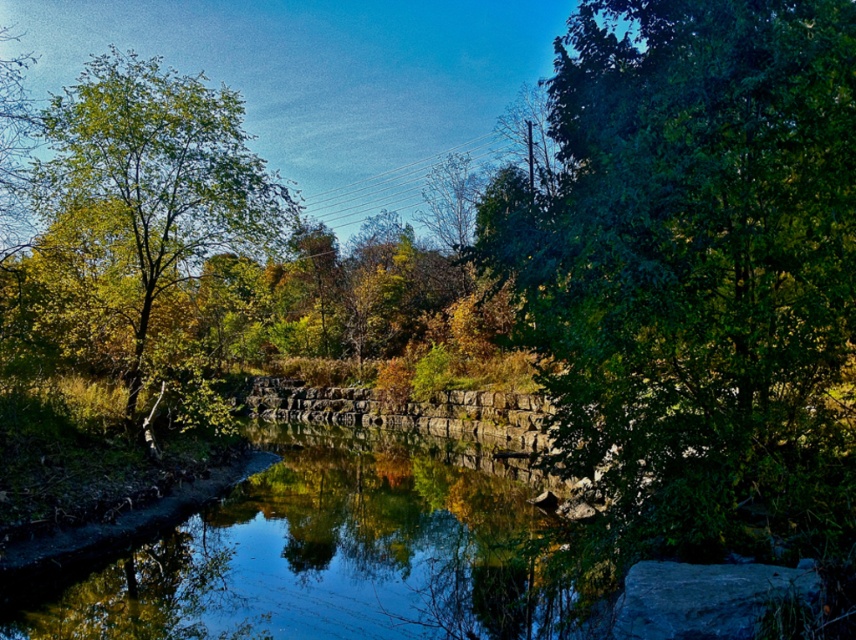
You are standing at the center of the image and want to locate the green leafy tree at upper right. According to the coordinates provided, in which direction should you look to find it?

The green leafy tree at upper right is located at point coordinates, so you should look towards the upper right direction to find it.

You are standing on the stone wall in the midground and want to look down at the clear water at center. Which direction should you look to see the reflection of the green leafy tree at left?

The clear water at center is below the green leafy tree at left, so you should look downward to see its reflection in the water.

You are standing at the edge of the water and want to determine which tree, the green leafy tree at upper right or the green leafy tree at left, takes up more visual space in the image. Based on their positions and sizes, which one would you say is larger?

The green leafy tree at left takes up more visual space in the image than the green leafy tree at upper right, so it is larger.